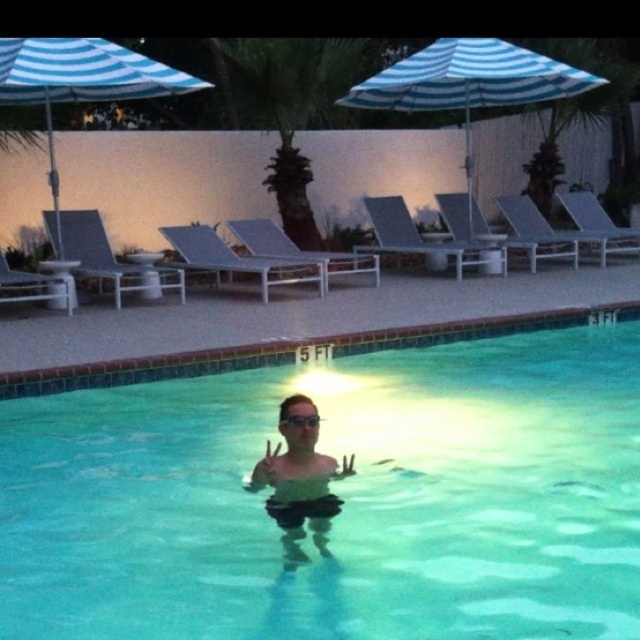
Question: Based on their relative distances, which object is nearer to the blue striped umbrella at upper left?

Choices:
 (A) clear glass water at center
 (B) transparent plastic goggles at center

Answer: (A)

Question: Is blue striped umbrella at upper center further to camera compared to transparent plastic goggles at center?

Choices:
 (A) no
 (B) yes

Answer: (B)

Question: Which object appears closest to the camera in this image?

Choices:
 (A) blue striped umbrella at upper center
 (B) clear glass water at center
 (C) transparent plastic goggles at center

Answer: (C)

Question: Is blue striped umbrella at upper center wider than clear skin at center?

Choices:
 (A) yes
 (B) no

Answer: (A)

Question: Which of the following is the closest to the observer?

Choices:
 (A) blue striped umbrella at upper center
 (B) clear skin at center
 (C) clear glass water at center

Answer: (B)

Question: In this image, where is blue striped umbrella at upper left located relative to transparent plastic goggles at center?

Choices:
 (A) left
 (B) right

Answer: (A)